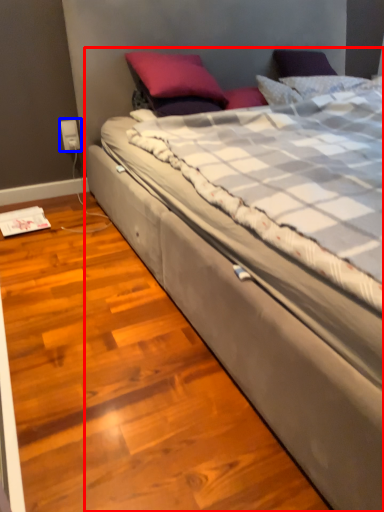
Question: Which object appears closest to the camera in this image, bed (highlighted by a red box) or electric outlet (highlighted by a blue box)?

Choices:
 (A) bed
 (B) electric outlet

Answer: (A)